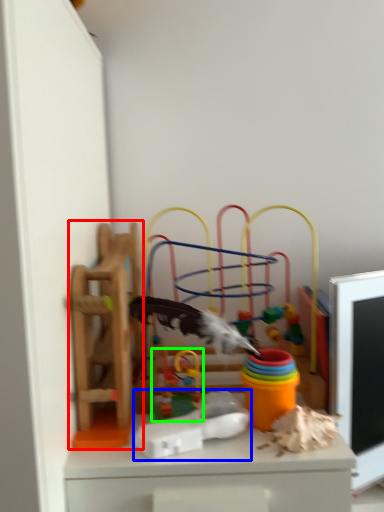
Question: Estimate the real-world distances between objects in this image. Which object is farther from toy (highlighted by a red box), toy (highlighted by a blue box) or toy (highlighted by a green box)?

Choices:
 (A) toy
 (B) toy

Answer: (A)